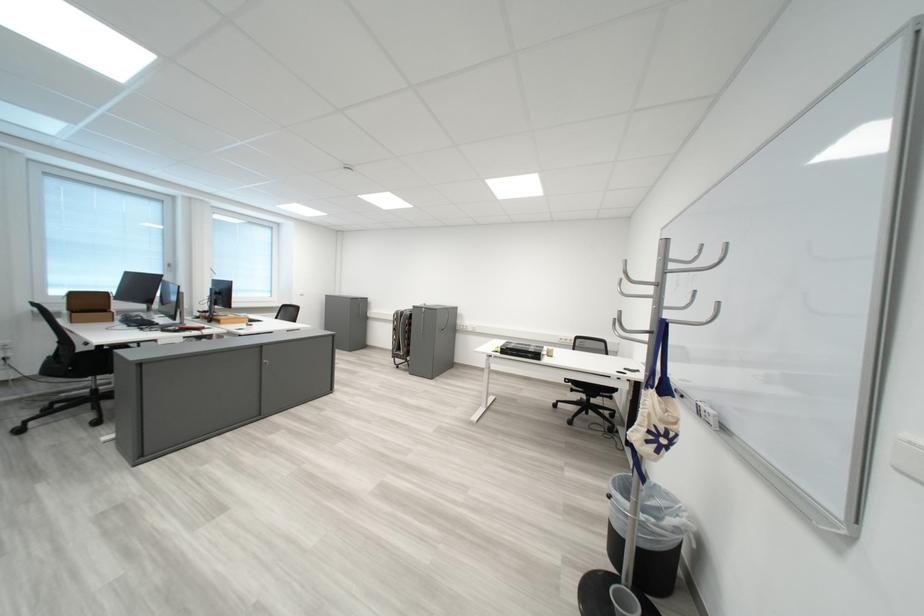
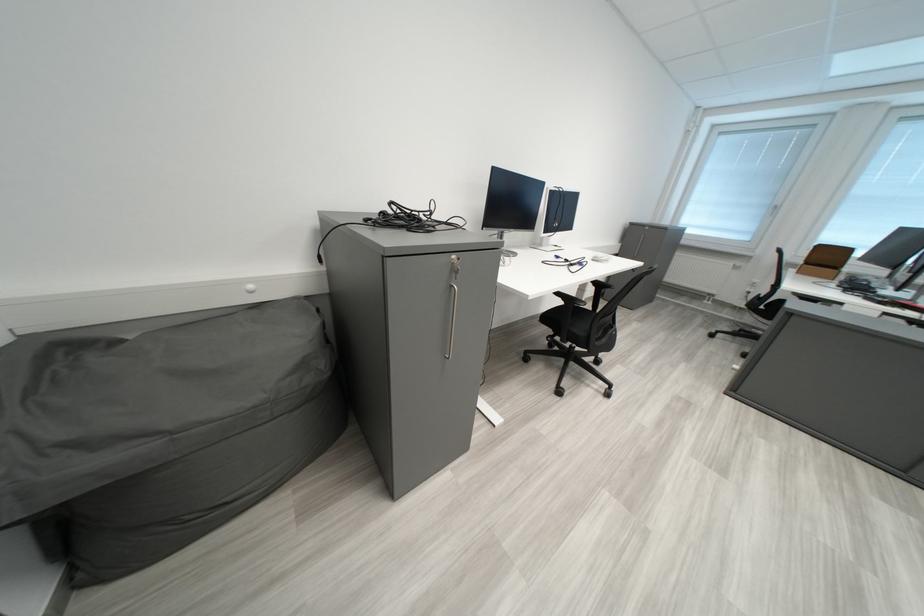
The first image is from the beginning of the video and the second image is from the end. How did the camera likely rotate when shooting the video?

The camera rotated toward left-down.